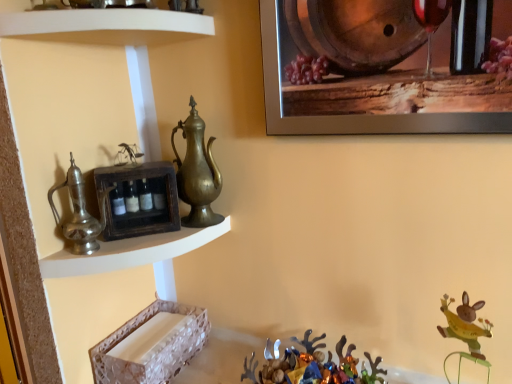
In order to face metallic silver frame at upper left, which is the third shelf from top to bottom, should I rotate leftwards or rightwards?

Rotate left and turn 14.533 degrees.

What is the approximate width of metallic silver frame at upper left, the second shelf positioned from the bottom?

metallic silver frame at upper left, the second shelf positioned from the bottom, is 9.81 inches wide.

Image resolution: width=512 pixels, height=384 pixels. What do you see at coordinates (311, 365) in the screenshot?
I see `metallic silver reindeer at lower center` at bounding box center [311, 365].

This screenshot has height=384, width=512. Describe the element at coordinates (106, 26) in the screenshot. I see `white glossy shelf at upper left, marked as the 4th shelf in a bottom-to-top arrangement` at that location.

Image resolution: width=512 pixels, height=384 pixels. What do you see at coordinates (80, 213) in the screenshot? I see `brushed metal jug at left, placed as the 2th jug when sorted from right to left` at bounding box center [80, 213].

Locate an element on the screen. The height and width of the screenshot is (384, 512). white textured tray at lower left, the fourth shelf when ordered from top to bottom is located at coordinates (151, 345).

I want to click on metallic silver frame at upper left, which is the third shelf from top to bottom, so click(131, 252).

From the image's perspective, would you say wooden barrel at upper right is shown under brass/bronze jug at center, the 2th jug viewed from the front?

Actually, wooden barrel at upper right appears above brass/bronze jug at center, the 2th jug viewed from the front, in the image.

Is wooden barrel at upper right shorter than brass/bronze jug at center, acting as the first jug starting from the right?

No, wooden barrel at upper right is not shorter than brass/bronze jug at center, acting as the first jug starting from the right.

Considering their positions, is wooden barrel at upper right located in front of or behind brass/bronze jug at center, the 2th jug viewed from the front?

Clearly, wooden barrel at upper right is in front of brass/bronze jug at center, the 2th jug viewed from the front.

Which object is wider, wooden barrel at upper right or brass/bronze jug at center, the 2th jug viewed from the front?

brass/bronze jug at center, the 2th jug viewed from the front.

Is point (140, 214) farther from camera compared to point (82, 200)?

That is True.

From a real-world perspective, is wooden crate at upper left, which appears as the 3th shelf when ordered from the bottom, under brushed metal jug at left, positioned as the second jug in back-to-front order?

Yes, from a real-world perspective, wooden crate at upper left, which appears as the 3th shelf when ordered from the bottom, is under brushed metal jug at left, positioned as the second jug in back-to-front order.

Does wooden crate at upper left, placed as the 2th shelf when sorted from top to bottom, lie behind brushed metal jug at left, placed as the first jug when sorted from front to back?

Yes, wooden crate at upper left, placed as the 2th shelf when sorted from top to bottom, is behind brushed metal jug at left, placed as the first jug when sorted from front to back.

Is wooden crate at upper left, which appears as the 3th shelf when ordered from the bottom, taller or shorter than brushed metal jug at left, placed as the first jug when sorted from front to back?

Clearly, wooden crate at upper left, which appears as the 3th shelf when ordered from the bottom, is shorter compared to brushed metal jug at left, placed as the first jug when sorted from front to back.

Could you tell me if white textured tray at lower left, the 1th shelf positioned from the bottom, is facing brushed metal jug at left, placed as the first jug when sorted from front to back?

No, white textured tray at lower left, the 1th shelf positioned from the bottom, is not oriented towards brushed metal jug at left, placed as the first jug when sorted from front to back.

Which is in front, point (185, 347) or point (79, 204)?

The point (79, 204) is more forward.

At what (x,y) coordinates should I click in order to perform the action: click on the 2nd shelf behind the brushed metal jug at left, positioned as the second jug in back-to-front order, starting your count from the anchor. Please return your answer as a coordinate pair (x, y). The height and width of the screenshot is (384, 512). Looking at the image, I should click on (151, 345).

Which is correct: white textured tray at lower left, the fourth shelf when ordered from top to bottom, is inside brushed metal jug at left, placed as the 2th jug when sorted from right to left, or outside of it?

white textured tray at lower left, the fourth shelf when ordered from top to bottom, is located beyond the bounds of brushed metal jug at left, placed as the 2th jug when sorted from right to left.

Considering the relative sizes of wooden crate at upper left, placed as the 2th shelf when sorted from top to bottom, and white glossy shelf at upper left, which is the first shelf from top to bottom, in the image provided, is wooden crate at upper left, placed as the 2th shelf when sorted from top to bottom, shorter than white glossy shelf at upper left, which is the first shelf from top to bottom,?

Incorrect, the height of wooden crate at upper left, placed as the 2th shelf when sorted from top to bottom, does not fall short of that of white glossy shelf at upper left, which is the first shelf from top to bottom.

Can you confirm if wooden crate at upper left, placed as the 2th shelf when sorted from top to bottom, is smaller than white glossy shelf at upper left, marked as the 4th shelf in a bottom-to-top arrangement?

Yes, wooden crate at upper left, placed as the 2th shelf when sorted from top to bottom, is smaller than white glossy shelf at upper left, marked as the 4th shelf in a bottom-to-top arrangement.

Considering the relative positions of wooden crate at upper left, placed as the 2th shelf when sorted from top to bottom, and white glossy shelf at upper left, marked as the 4th shelf in a bottom-to-top arrangement, in the image provided, is wooden crate at upper left, placed as the 2th shelf when sorted from top to bottom, to the right of white glossy shelf at upper left, marked as the 4th shelf in a bottom-to-top arrangement, from the viewer's perspective?

Indeed, wooden crate at upper left, placed as the 2th shelf when sorted from top to bottom, is positioned on the right side of white glossy shelf at upper left, marked as the 4th shelf in a bottom-to-top arrangement.

Is white glossy shelf at upper left, which is the first shelf from top to bottom, at the back of wooden crate at upper left, which appears as the 3th shelf when ordered from the bottom?

No, white glossy shelf at upper left, which is the first shelf from top to bottom, is not at the back of wooden crate at upper left, which appears as the 3th shelf when ordered from the bottom.

Can you confirm if brass/bronze jug at center, the 2th jug viewed from the front, is taller than wooden crate at upper left, which appears as the 3th shelf when ordered from the bottom?

Yes.

Looking at this image, from the image's perspective, between brass/bronze jug at center, placed as the first jug when sorted from back to front, and wooden crate at upper left, placed as the 2th shelf when sorted from top to bottom, who is located below?

wooden crate at upper left, placed as the 2th shelf when sorted from top to bottom, appears lower in the image.

Are brass/bronze jug at center, the 2th jug positioned from the left, and wooden crate at upper left, which appears as the 3th shelf when ordered from the bottom, far apart?

brass/bronze jug at center, the 2th jug positioned from the left, is actually quite close to wooden crate at upper left, which appears as the 3th shelf when ordered from the bottom.

Between brass/bronze jug at center, placed as the first jug when sorted from back to front, and wooden crate at upper left, which appears as the 3th shelf when ordered from the bottom, which one has larger size?

brass/bronze jug at center, placed as the first jug when sorted from back to front.

From the image's perspective, which one is positioned higher, metallic silver reindeer at lower center or white glossy shelf at upper left, marked as the 4th shelf in a bottom-to-top arrangement?

white glossy shelf at upper left, marked as the 4th shelf in a bottom-to-top arrangement, appears higher in the image.

Does metallic silver reindeer at lower center have a smaller size compared to white glossy shelf at upper left, marked as the 4th shelf in a bottom-to-top arrangement?

No.

Considering the relative sizes of metallic silver reindeer at lower center and white glossy shelf at upper left, which is the first shelf from top to bottom, in the image provided, is metallic silver reindeer at lower center taller than white glossy shelf at upper left, which is the first shelf from top to bottom,?

Indeed, metallic silver reindeer at lower center has a greater height compared to white glossy shelf at upper left, which is the first shelf from top to bottom.

Is metallic silver reindeer at lower center oriented towards white glossy shelf at upper left, marked as the 4th shelf in a bottom-to-top arrangement?

No, metallic silver reindeer at lower center is not turned towards white glossy shelf at upper left, marked as the 4th shelf in a bottom-to-top arrangement.

Is white textured tray at lower left, the 1th shelf positioned from the bottom, facing away from wooden crate at upper left, which appears as the 3th shelf when ordered from the bottom?

white textured tray at lower left, the 1th shelf positioned from the bottom, is not turned away from wooden crate at upper left, which appears as the 3th shelf when ordered from the bottom.

From a real-world perspective, relative to wooden crate at upper left, placed as the 2th shelf when sorted from top to bottom, is white textured tray at lower left, the 1th shelf positioned from the bottom, vertically above or below?

white textured tray at lower left, the 1th shelf positioned from the bottom, is below wooden crate at upper left, placed as the 2th shelf when sorted from top to bottom.

Which is correct: white textured tray at lower left, the 1th shelf positioned from the bottom, is inside wooden crate at upper left, which appears as the 3th shelf when ordered from the bottom, or outside of it?

white textured tray at lower left, the 1th shelf positioned from the bottom, is spatially situated outside wooden crate at upper left, which appears as the 3th shelf when ordered from the bottom.

Considering the sizes of objects white textured tray at lower left, the fourth shelf when ordered from top to bottom, and wooden crate at upper left, placed as the 2th shelf when sorted from top to bottom, in the image provided, who is bigger, white textured tray at lower left, the fourth shelf when ordered from top to bottom, or wooden crate at upper left, placed as the 2th shelf when sorted from top to bottom,?

With larger size is white textured tray at lower left, the fourth shelf when ordered from top to bottom.

Starting from the wooden barrel at upper right, which jug is the 1st one to the left? Please provide its 2D coordinates.

[(197, 172)]

Identify the location of jug that is in front of the wooden crate at upper left, placed as the 2th shelf when sorted from top to bottom. (80, 213).

When comparing their distances from brass/bronze jug at center, acting as the first jug starting from the right, does white textured tray at lower left, the fourth shelf when ordered from top to bottom, or white glossy shelf at upper left, which is the first shelf from top to bottom, seem closer?

white glossy shelf at upper left, which is the first shelf from top to bottom.

From the image, which object appears to be farther from white textured tray at lower left, the 1th shelf positioned from the bottom, brass/bronze jug at center, placed as the first jug when sorted from back to front, or brushed metal jug at left, placed as the 2th jug when sorted from right to left?

brass/bronze jug at center, placed as the first jug when sorted from back to front.

Based on their spatial positions, is white glossy shelf at upper left, which is the first shelf from top to bottom, or wooden crate at upper left, placed as the 2th shelf when sorted from top to bottom, closer to metallic silver reindeer at lower center?

Based on the image, wooden crate at upper left, placed as the 2th shelf when sorted from top to bottom, appears to be nearer to metallic silver reindeer at lower center.

Which object lies nearer to the anchor point brass/bronze jug at center, the 2th jug positioned from the left, metallic silver reindeer at lower center or metallic silver frame at upper left, which is the third shelf from top to bottom?

metallic silver frame at upper left, which is the third shelf from top to bottom, is positioned closer to the anchor brass/bronze jug at center, the 2th jug positioned from the left.

In the scene shown: Considering their positions, is wooden barrel at upper right positioned further to metallic silver reindeer at lower center than wooden crate at upper left, which appears as the 3th shelf when ordered from the bottom?

wooden barrel at upper right lies further to metallic silver reindeer at lower center than the other object.

Based on the photo, from the image, which object appears to be nearer to metallic silver frame at upper left, the second shelf positioned from the bottom, brushed metal jug at left, positioned as the second jug in back-to-front order, or metallic silver reindeer at lower center?

brushed metal jug at left, positioned as the second jug in back-to-front order, is closer to metallic silver frame at upper left, the second shelf positioned from the bottom.

Estimate the real-world distances between objects in this image. Which object is further from white textured tray at lower left, the fourth shelf when ordered from top to bottom, wooden barrel at upper right or brushed metal jug at left, placed as the first jug when sorted from front to back?

wooden barrel at upper right.

Considering their positions, is wooden crate at upper left, placed as the 2th shelf when sorted from top to bottom, positioned further to white glossy shelf at upper left, which is the first shelf from top to bottom, than brass/bronze jug at center, the 2th jug viewed from the front?

wooden crate at upper left, placed as the 2th shelf when sorted from top to bottom, lies further to white glossy shelf at upper left, which is the first shelf from top to bottom, than the other object.

The height and width of the screenshot is (384, 512). I want to click on jug between wooden crate at upper left, which appears as the 3th shelf when ordered from the bottom, and white textured tray at lower left, the 1th shelf positioned from the bottom, vertically, so click(80, 213).

The image size is (512, 384). In order to click on shelf that lies between brushed metal jug at left, placed as the 2th jug when sorted from right to left, and white textured tray at lower left, the 1th shelf positioned from the bottom, from top to bottom in this screenshot , I will do `click(131, 252)`.

At what (x,y) coordinates should I click in order to perform the action: click on jug that lies between white glossy shelf at upper left, which is the first shelf from top to bottom, and wooden crate at upper left, placed as the 2th shelf when sorted from top to bottom, from top to bottom. Please return your answer as a coordinate pair (x, y). The image size is (512, 384). Looking at the image, I should click on (197, 172).

Identify the location of jug between metallic silver frame at upper left, the second shelf positioned from the bottom, and wooden barrel at upper right from left to right. The height and width of the screenshot is (384, 512). (197, 172).